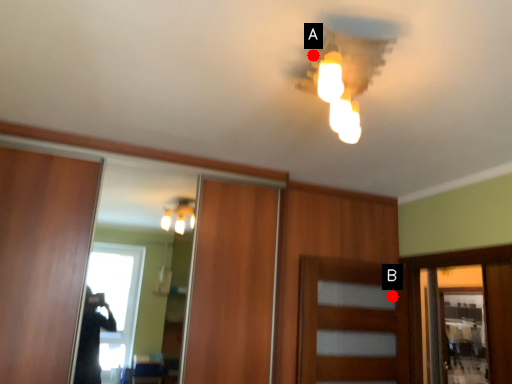
Question: Two points are circled on the image, labeled by A and B beside each circle. Which point is closer to the camera?

Choices:
 (A) A is closer
 (B) B is closer

Answer: (A)